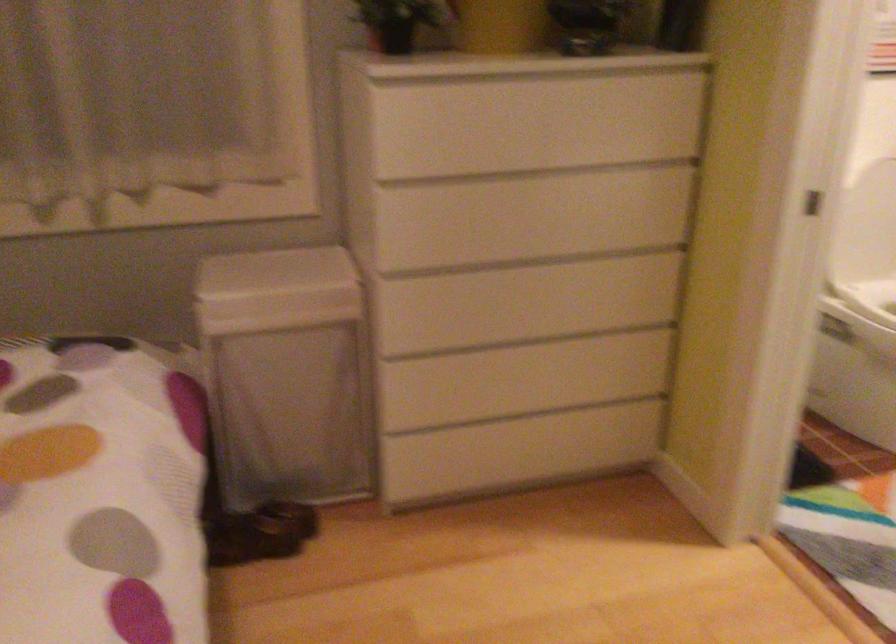
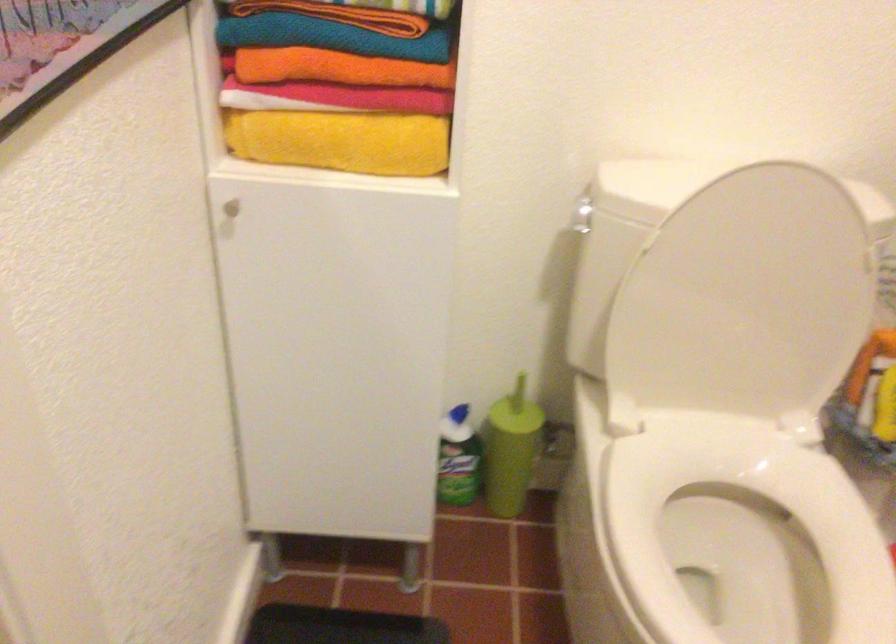
Locate, in the second image, the point that corresponds to the point at 713,147 in the first image.

(339, 68)